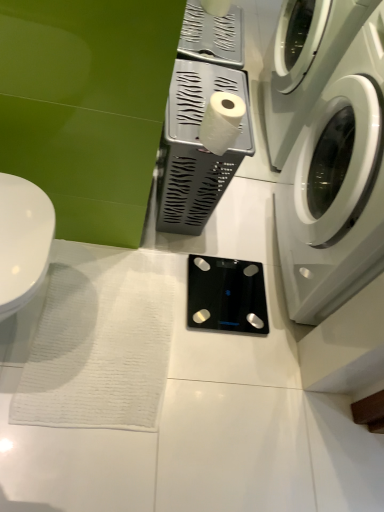
At what (x,y) coordinates should I click in order to perform the action: click on free space that is to the left of white glossy washing machine at right. Please return your answer as a coordinate pair (x, y). Looking at the image, I should click on (215, 241).